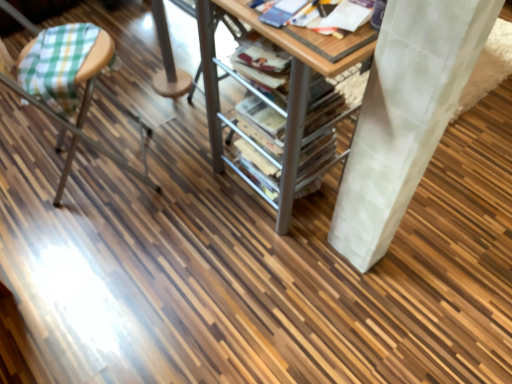
This screenshot has width=512, height=384. Describe the element at coordinates (294, 98) in the screenshot. I see `wooden table at center` at that location.

Measure the distance between point [212,100] and camera.

They are 1.41 meters apart.

Find the location of `wooden table at center`. wooden table at center is located at coordinates (294, 98).

What are the coordinates of `green plaid fabric stool at left` in the screenshot? It's located at (86, 112).

What do you see at coordinates (86, 112) in the screenshot? I see `green plaid fabric stool at left` at bounding box center [86, 112].

What is the approximate height of green plaid fabric stool at left?

green plaid fabric stool at left is 31.27 inches in height.

Locate an element on the screen. wooden table at center is located at coordinates (294, 98).

Which object is positioned more to the left, wooden table at center or green plaid fabric stool at left?

Positioned to the left is green plaid fabric stool at left.

Between wooden table at center and green plaid fabric stool at left, which one is positioned behind?

green plaid fabric stool at left is further from the camera.

Considering the positions of points (208, 61) and (82, 137), is point (208, 61) closer to camera compared to point (82, 137)?

Yes.

From the image's perspective, which is above, wooden table at center or green plaid fabric stool at left?

wooden table at center is shown above in the image.

From a real-world perspective, is wooden table at center on top of green plaid fabric stool at left?

No, from a real-world perspective, wooden table at center is not on top of green plaid fabric stool at left.

Considering the relative sizes of wooden table at center and green plaid fabric stool at left in the image provided, is wooden table at center thinner than green plaid fabric stool at left?

Yes, wooden table at center is thinner than green plaid fabric stool at left.

Is wooden table at center shorter than green plaid fabric stool at left?

Yes.

Which of these two, wooden table at center or green plaid fabric stool at left, is bigger?

With larger size is wooden table at center.

Is wooden table at center inside the boundaries of green plaid fabric stool at left, or outside?

wooden table at center exists outside the volume of green plaid fabric stool at left.

Is wooden table at center next to green plaid fabric stool at left and touching it?

No, wooden table at center is not touching green plaid fabric stool at left.

Is wooden table at center aimed at green plaid fabric stool at left?

Yes, wooden table at center is oriented towards green plaid fabric stool at left.

Locate an element on the screen. This screenshot has width=512, height=384. table located on the right of green plaid fabric stool at left is located at coordinates (294, 98).

Visually, is green plaid fabric stool at left positioned to the left or to the right of wooden table at center?

green plaid fabric stool at left is positioned on wooden table at center's left side.

Which is behind, green plaid fabric stool at left or wooden table at center?

green plaid fabric stool at left is further from the camera.

Which is in front, point (60, 181) or point (204, 8)?

The point (204, 8) is more forward.

From the image's perspective, which object appears higher, green plaid fabric stool at left or wooden table at center?

wooden table at center is shown above in the image.

From a real-world perspective, is green plaid fabric stool at left located higher than wooden table at center?

Yes, from a real-world perspective, green plaid fabric stool at left is above wooden table at center.

In terms of width, does green plaid fabric stool at left look wider or thinner when compared to wooden table at center?

Clearly, green plaid fabric stool at left has more width compared to wooden table at center.

Who is shorter, green plaid fabric stool at left or wooden table at center?

With less height is wooden table at center.

From the picture: Who is smaller, green plaid fabric stool at left or wooden table at center?

With smaller size is green plaid fabric stool at left.

Do you think green plaid fabric stool at left is within wooden table at center, or outside of it?

green plaid fabric stool at left is outside wooden table at center.

Is green plaid fabric stool at left with wooden table at center?

green plaid fabric stool at left and wooden table at center are clearly separated.

Could you tell me if green plaid fabric stool at left is facing wooden table at center?

Yes, green plaid fabric stool at left is aimed at wooden table at center.

How different are the orientations of green plaid fabric stool at left and wooden table at center in degrees?

They differ by 24.8 degrees in their facing directions.

This screenshot has width=512, height=384. I want to click on table on the right side of green plaid fabric stool at left, so click(x=294, y=98).

This screenshot has width=512, height=384. Identify the location of table above the green plaid fabric stool at left (from the image's perspective). (294, 98).

Identify the location of furniture above the wooden table at center (from a real-world perspective). (86, 112).